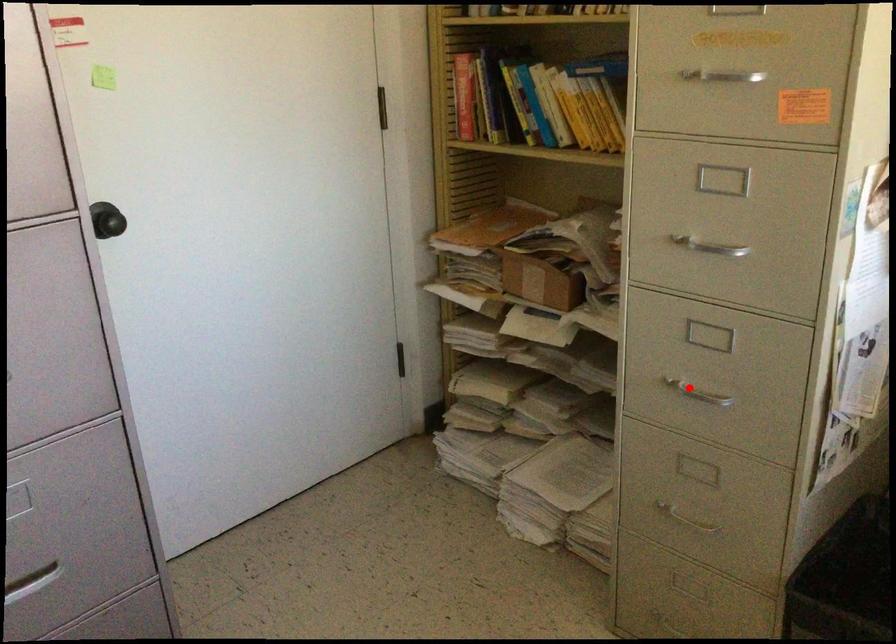
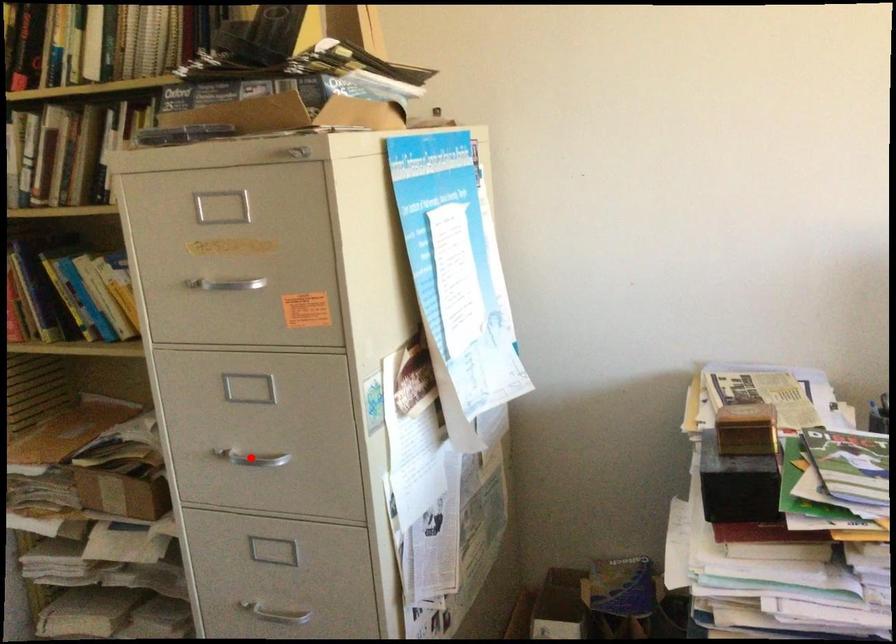
I am providing you with two images of the same scene from different viewpoints. A red point is marked on the first image and another point is marked on the second image. Does the point marked in image1 correspond to the same location as the one in image2?

No